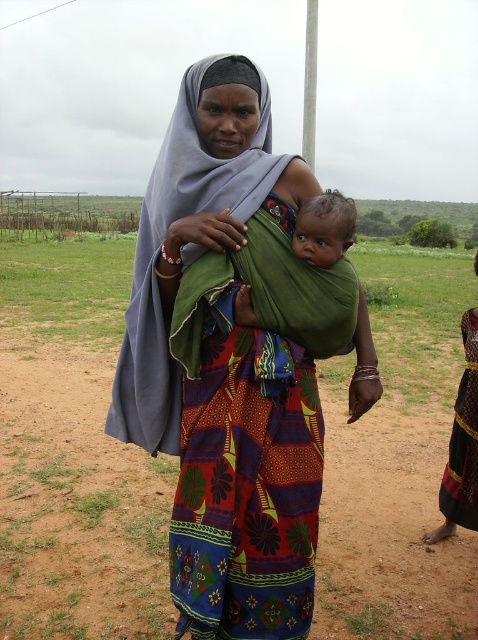
Question: Is multicolored fabric dress at center positioned behind dark red textured fabric dress at lower right?

Choices:
 (A) no
 (B) yes

Answer: (A)

Question: Which object appears farthest from the camera in this image?

Choices:
 (A) multicolored fabric dress at center
 (B) dark red textured fabric dress at lower right

Answer: (B)

Question: Does multicolored fabric dress at center have a greater width compared to dark red textured fabric dress at lower right?

Choices:
 (A) yes
 (B) no

Answer: (A)

Question: From the image, what is the correct spatial relationship of multicolored fabric dress at center in relation to dark red textured fabric dress at lower right?

Choices:
 (A) right
 (B) left

Answer: (B)

Question: Which object is closer to the camera taking this photo?

Choices:
 (A) multicolored fabric dress at center
 (B) dark red textured fabric dress at lower right

Answer: (A)